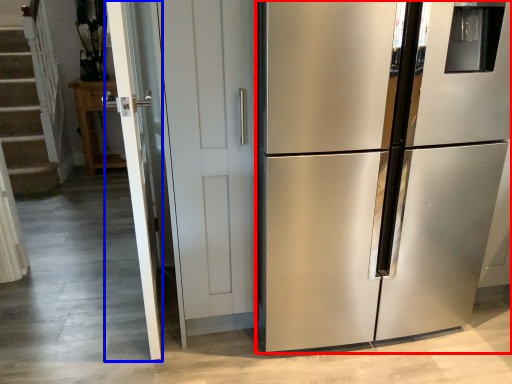
Question: Among these objects, which one is nearest to the camera, refrigerator (highlighted by a red box) or screen door (highlighted by a blue box)?

Choices:
 (A) refrigerator
 (B) screen door

Answer: (A)